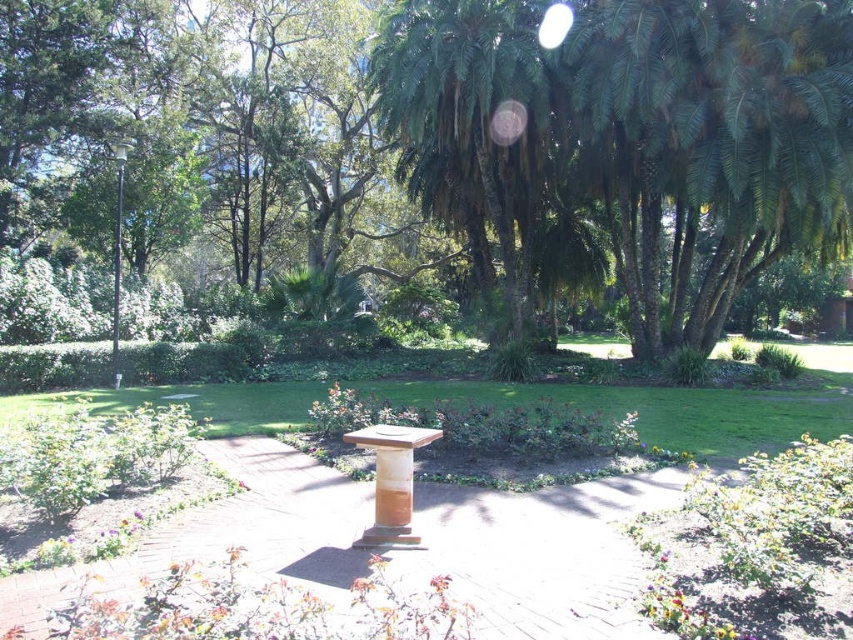
You are standing at the point marked as point [541,554] in the park. What object is exactly at your current location?

The brown wooden path at center is located at point [541,554].

You are a park visitor who wants to take a photo of the green leafy tree at center and the black metal pole at left. Which object will appear bigger in your camera viewfinder?

The green leafy tree at center will appear bigger in the camera viewfinder because it is larger in size than the black metal pole at left.